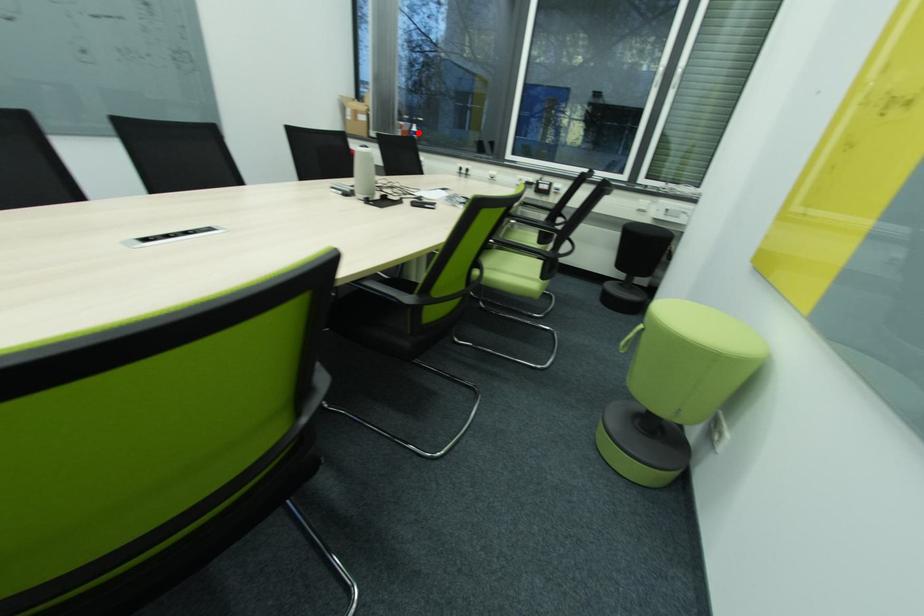
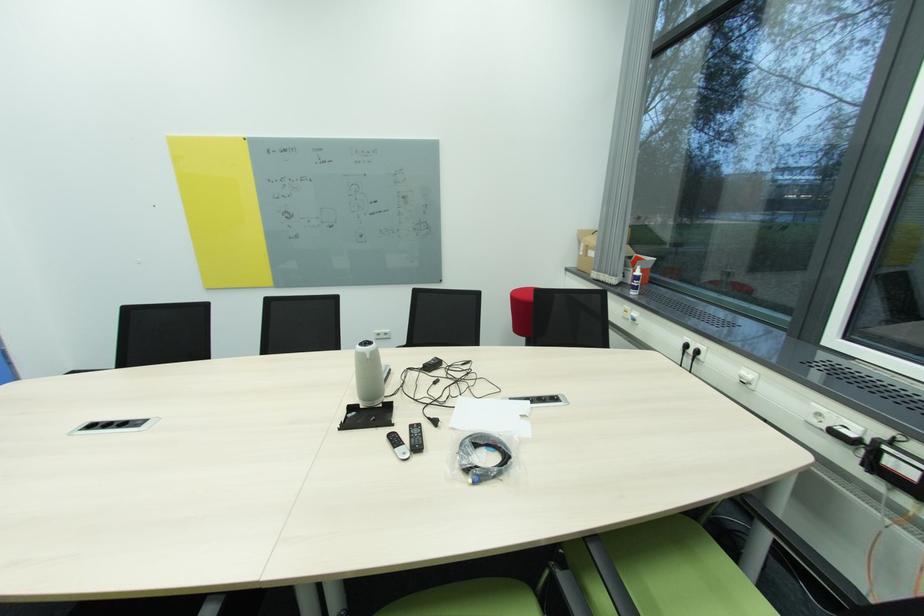
The point at the highlighted location is marked in the first image. Where is the corresponding point in the second image?

(639, 277)